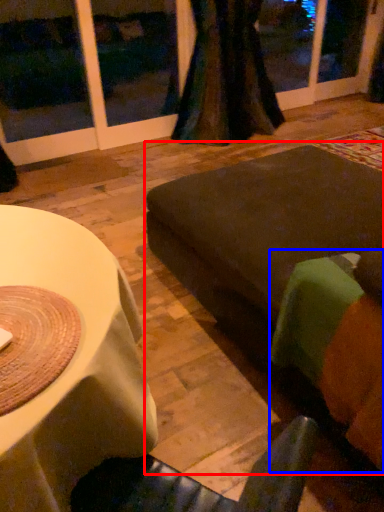
Question: Which point is further to the camera, couch (highlighted by a red box) or couch (highlighted by a blue box)?

Choices:
 (A) couch
 (B) couch

Answer: (A)